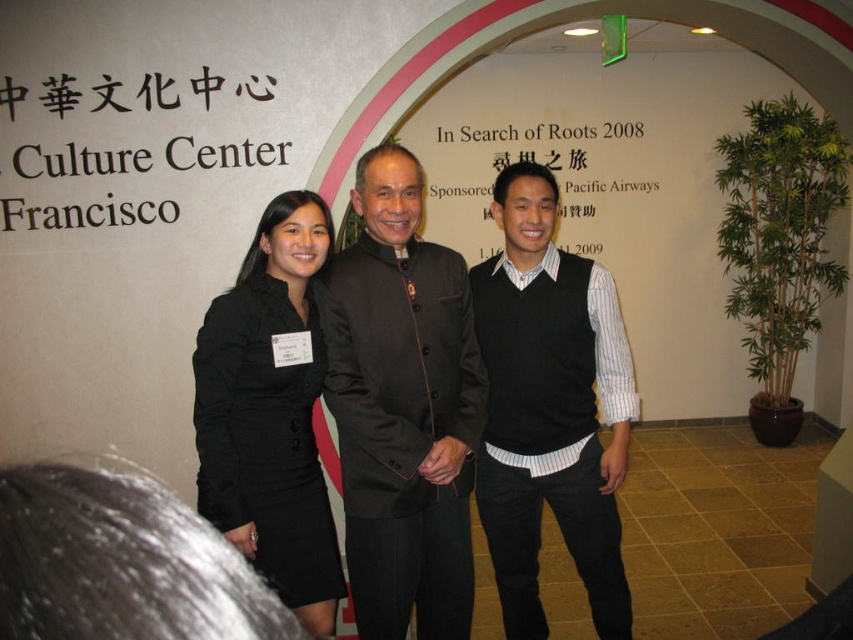
You are attending an event at the Culture Center in Francisco and see two people wearing the dark brown satin jacket at center and the black satin dress at center. Which one is wearing clothing that is lower in position?

The dark brown satin jacket at center is positioned under the black satin dress at center, so the person wearing the dark brown satin jacket at center has clothing that is lower in position.

You are a photographer at the event and need to take a group photo of the dark brown satin jacket at center and the black knit vest at center. Which one should you adjust to ensure both are fully visible in the frame?

The dark brown satin jacket at center is shorter than the black knit vest at center, so you should lower the camera angle slightly to include the full height of both items.